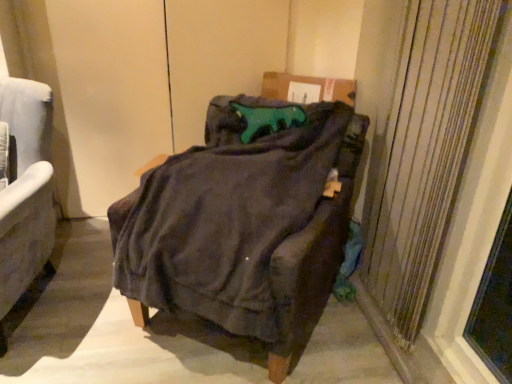
Question: Can you confirm if dark fabric chair at center, which is counted as the 1th chair, starting from the right, is wider than velvet gray armchair at left, the first chair viewed from the left?

Choices:
 (A) yes
 (B) no

Answer: (A)

Question: Is dark fabric chair at center, which ranks as the 2th chair in left-to-right order, positioned in front of velvet gray armchair at left, the second chair positioned from the right?

Choices:
 (A) yes
 (B) no

Answer: (A)

Question: Is dark fabric chair at center, which ranks as the 2th chair in left-to-right order, positioned far away from velvet gray armchair at left, the second chair positioned from the right?

Choices:
 (A) yes
 (B) no

Answer: (B)

Question: Can you confirm if dark fabric chair at center, which is counted as the 1th chair, starting from the right, is taller than velvet gray armchair at left, the second chair positioned from the right?

Choices:
 (A) yes
 (B) no

Answer: (B)

Question: Is dark fabric chair at center, which ranks as the 2th chair in left-to-right order, at the right side of velvet gray armchair at left, the second chair positioned from the right?

Choices:
 (A) no
 (B) yes

Answer: (B)

Question: From a real-world perspective, is dark fabric chair at center, which ranks as the 2th chair in left-to-right order, on velvet gray armchair at left, the first chair viewed from the left?

Choices:
 (A) yes
 (B) no

Answer: (B)

Question: Is the depth of velvet gray armchair at left, the second chair positioned from the right, less than that of textured beige curtain at right?

Choices:
 (A) no
 (B) yes

Answer: (A)

Question: Does velvet gray armchair at left, the second chair positioned from the right, have a greater height compared to textured beige curtain at right?

Choices:
 (A) no
 (B) yes

Answer: (A)

Question: From a real-world perspective, is velvet gray armchair at left, the second chair positioned from the right, physically below textured beige curtain at right?

Choices:
 (A) yes
 (B) no

Answer: (A)

Question: Does velvet gray armchair at left, the first chair viewed from the left, have a larger size compared to textured beige curtain at right?

Choices:
 (A) no
 (B) yes

Answer: (B)

Question: Is velvet gray armchair at left, the second chair positioned from the right, oriented away from textured beige curtain at right?

Choices:
 (A) yes
 (B) no

Answer: (B)

Question: Does velvet gray armchair at left, the second chair positioned from the right, appear on the right side of textured beige curtain at right?

Choices:
 (A) no
 (B) yes

Answer: (A)

Question: Can you see textured beige curtain at right touching dark fabric chair at center, which ranks as the 2th chair in left-to-right order?

Choices:
 (A) no
 (B) yes

Answer: (A)